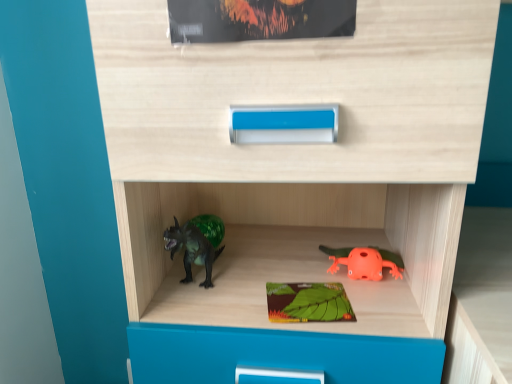
What is the approximate width of green matte board game at center, placed as the second paperback book when sorted from front to back?

4.62 inches.

I want to click on matte green paperback book at upper center, marked as the 2th paperback book in a back-to-front arrangement, so click(258, 19).

I want to click on toy above the green matte board game at center, which is counted as the 2th paperback book, starting from the top (from the image's perspective), so click(x=365, y=262).

From a real-world perspective, between orange matte frog at lower right and green matte board game at center, positioned as the 1th paperback book in back-to-front order, who is vertically higher?

orange matte frog at lower right.

Consider the image. Can you confirm if orange matte frog at lower right is wider than green matte board game at center, placed as the second paperback book when sorted from front to back?

Indeed, orange matte frog at lower right has a greater width compared to green matte board game at center, placed as the second paperback book when sorted from front to back.

Considering the sizes of objects orange matte frog at lower right and green matte board game at center, which is counted as the 2th paperback book, starting from the top, in the image provided, who is bigger, orange matte frog at lower right or green matte board game at center, which is counted as the 2th paperback book, starting from the top,?

orange matte frog at lower right is bigger.

Choose the correct answer: Is green matte board game at center, positioned as the 1th paperback book in back-to-front order, inside matte green paperback book at upper center, acting as the first paperback book starting from the top, or outside it?

The correct answer is: outside.

Would you consider green matte board game at center, placed as the second paperback book when sorted from front to back, to be distant from matte green paperback book at upper center, acting as the first paperback book starting from the top?

They are positioned close to each other.

Considering the positions of objects green matte board game at center, positioned as the 1th paperback book in back-to-front order, and matte green paperback book at upper center, arranged as the 2th paperback book when ordered from the bottom, in the image provided, who is more to the left, green matte board game at center, positioned as the 1th paperback book in back-to-front order, or matte green paperback book at upper center, arranged as the 2th paperback book when ordered from the bottom,?

matte green paperback book at upper center, arranged as the 2th paperback book when ordered from the bottom.

Is the depth of green matte board game at center, which ranks as the 1th paperback book in bottom-to-top order, less than that of matte green paperback book at upper center, arranged as the 2th paperback book when ordered from the bottom?

No.

Can you confirm if matte green paperback book at upper center, the 1th paperback book viewed from the front, is taller than orange matte frog at lower right?

Correct, matte green paperback book at upper center, the 1th paperback book viewed from the front, is much taller as orange matte frog at lower right.

Can you confirm if matte green paperback book at upper center, the 1th paperback book viewed from the front, is smaller than orange matte frog at lower right?

No, matte green paperback book at upper center, the 1th paperback book viewed from the front, is not smaller than orange matte frog at lower right.

From a real-world perspective, which object rests below the other?

orange matte frog at lower right, from a real-world perspective.

Would you say matte green paperback book at upper center, arranged as the 2th paperback book when ordered from the bottom, is inside or outside orange matte frog at lower right?

matte green paperback book at upper center, arranged as the 2th paperback book when ordered from the bottom, is not enclosed by orange matte frog at lower right.

Is matte green paperback book at upper center, arranged as the 2th paperback book when ordered from the bottom, to the left or to the right of green matte board game at center, which ranks as the 1th paperback book in bottom-to-top order, in the image?

matte green paperback book at upper center, arranged as the 2th paperback book when ordered from the bottom, is positioned on green matte board game at center, which ranks as the 1th paperback book in bottom-to-top order,'s left side.

From the image's perspective, which is above, matte green paperback book at upper center, acting as the first paperback book starting from the top, or green matte board game at center, which ranks as the 1th paperback book in bottom-to-top order?

matte green paperback book at upper center, acting as the first paperback book starting from the top, appears higher in the image.

Who is taller, matte green paperback book at upper center, marked as the 2th paperback book in a back-to-front arrangement, or green matte board game at center, placed as the second paperback book when sorted from front to back?

Standing taller between the two is matte green paperback book at upper center, marked as the 2th paperback book in a back-to-front arrangement.

Between point (350, 264) and point (222, 18), which one is positioned behind?

The point (350, 264) is more distant.

From the image's perspective, is orange matte frog at lower right over matte green paperback book at upper center, marked as the 2th paperback book in a back-to-front arrangement?

No, from the image's perspective, orange matte frog at lower right is not on top of matte green paperback book at upper center, marked as the 2th paperback book in a back-to-front arrangement.

In the scene shown: Which object is more forward, orange matte frog at lower right or matte green paperback book at upper center, arranged as the 2th paperback book when ordered from the bottom?

matte green paperback book at upper center, arranged as the 2th paperback book when ordered from the bottom.

Is orange matte frog at lower right positioned with its back to matte green paperback book at upper center, marked as the 2th paperback book in a back-to-front arrangement?

orange matte frog at lower right does not have its back to matte green paperback book at upper center, marked as the 2th paperback book in a back-to-front arrangement.

How many degrees apart are the facing directions of green matte board game at center, positioned as the 1th paperback book in back-to-front order, and orange matte frog at lower right?

green matte board game at center, positioned as the 1th paperback book in back-to-front order, and orange matte frog at lower right are facing 7.84 degrees away from each other.

Is point (306, 315) farther from camera compared to point (369, 273)?

No, (306, 315) is closer to viewer.

From the image's perspective, which is below, green matte board game at center, placed as the second paperback book when sorted from front to back, or orange matte frog at lower right?

green matte board game at center, placed as the second paperback book when sorted from front to back.

The width and height of the screenshot is (512, 384). In order to click on toy that is above the green matte board game at center, placed as the second paperback book when sorted from front to back (from the image's perspective) in this screenshot , I will do `click(365, 262)`.

At what (x,y) coordinates should I click in order to perform the action: click on toy above the green matte board game at center, which is counted as the 2th paperback book, starting from the top (from a real-world perspective). Please return your answer as a coordinate pair (x, y). The image size is (512, 384). Looking at the image, I should click on [365, 262].

Identify the location of paperback book behind the matte green paperback book at upper center, the 1th paperback book viewed from the front. The image size is (512, 384). (308, 302).

Based on their spatial positions, is matte green paperback book at upper center, arranged as the 2th paperback book when ordered from the bottom, or orange matte frog at lower right further from green matte board game at center, placed as the second paperback book when sorted from front to back?

matte green paperback book at upper center, arranged as the 2th paperback book when ordered from the bottom, lies further to green matte board game at center, placed as the second paperback book when sorted from front to back, than the other object.

When comparing their distances from orange matte frog at lower right, does matte green paperback book at upper center, arranged as the 2th paperback book when ordered from the bottom, or green matte board game at center, placed as the second paperback book when sorted from front to back, seem closer?

Among the two, green matte board game at center, placed as the second paperback book when sorted from front to back, is located nearer to orange matte frog at lower right.

Looking at the image, which one is located closer to orange matte frog at lower right, green matte board game at center, which ranks as the 1th paperback book in bottom-to-top order, or matte green paperback book at upper center, marked as the 2th paperback book in a back-to-front arrangement?

Based on the image, green matte board game at center, which ranks as the 1th paperback book in bottom-to-top order, appears to be nearer to orange matte frog at lower right.

Which object lies further to the anchor point matte green paperback book at upper center, arranged as the 2th paperback book when ordered from the bottom, orange matte frog at lower right or green matte board game at center, which is counted as the 2th paperback book, starting from the top?

Based on the image, orange matte frog at lower right appears to be further to matte green paperback book at upper center, arranged as the 2th paperback book when ordered from the bottom.

Looking at this image, when comparing their distances from matte green paperback book at upper center, the 1th paperback book viewed from the front, does green matte board game at center, which ranks as the 1th paperback book in bottom-to-top order, or orange matte frog at lower right seem closer?

green matte board game at center, which ranks as the 1th paperback book in bottom-to-top order.

Estimate the real-world distances between objects in this image. Which object is closer to green matte board game at center, which is counted as the 2th paperback book, starting from the top, orange matte frog at lower right or matte green paperback book at upper center, acting as the first paperback book starting from the top?

orange matte frog at lower right is positioned closer to the anchor green matte board game at center, which is counted as the 2th paperback book, starting from the top.

Identify the location of toy that lies between matte green paperback book at upper center, the 1th paperback book viewed from the front, and green matte board game at center, which ranks as the 1th paperback book in bottom-to-top order, from top to bottom. (365, 262).